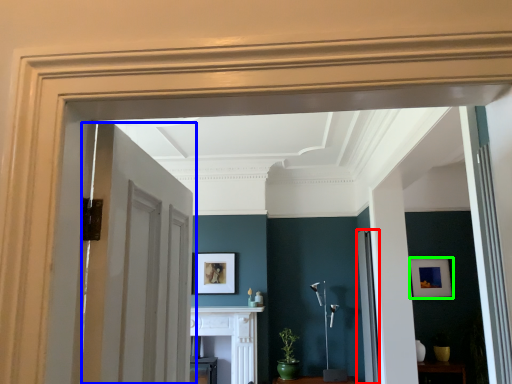
Question: Which is farther away from door (highlighted by a red box)? door (highlighted by a blue box) or picture frame (highlighted by a green box)?

Choices:
 (A) door
 (B) picture frame

Answer: (A)